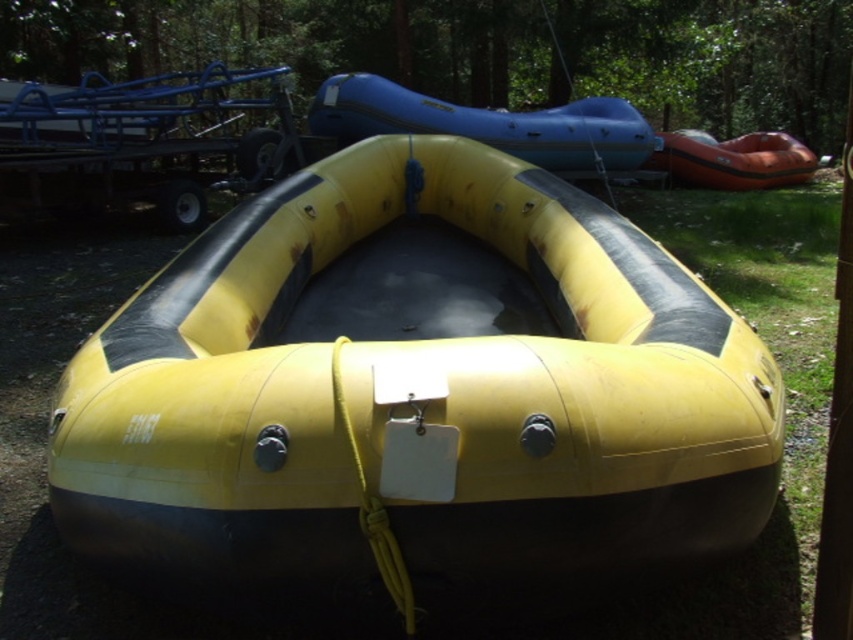
You are standing in a wooded area looking at two points marked in the image. Which point, point (521, 161) or point (804, 173), is closer to you?

Point (521, 161) is closer to the viewer than point (804, 173).

You are navigating a drone over a wooded area and need to land it precisely on the rubberized blue raft at upper center. According to the coordinates provided, what are the exact coordinates where you should direct the drone to land?

The rubberized blue raft at upper center is located at point (486, 124), so you should direct the drone to land there.